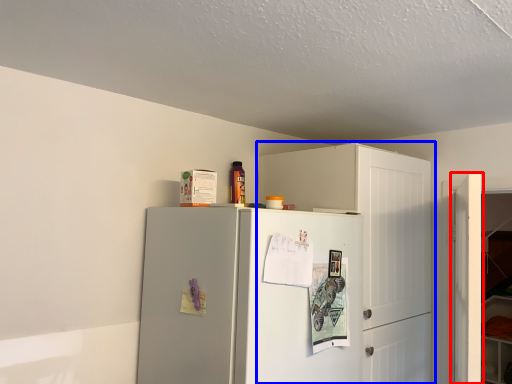
Question: Which object is further to the camera taking this photo, door (highlighted by a red box) or cabinetry (highlighted by a blue box)?

Choices:
 (A) door
 (B) cabinetry

Answer: (B)